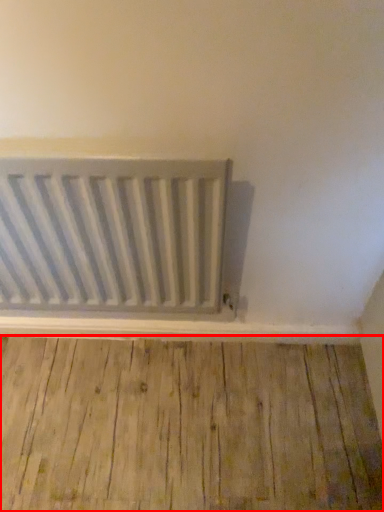
Question: Where is hardwood (annotated by the red box) located in relation to radiator in the image?

Choices:
 (A) left
 (B) right

Answer: (B)